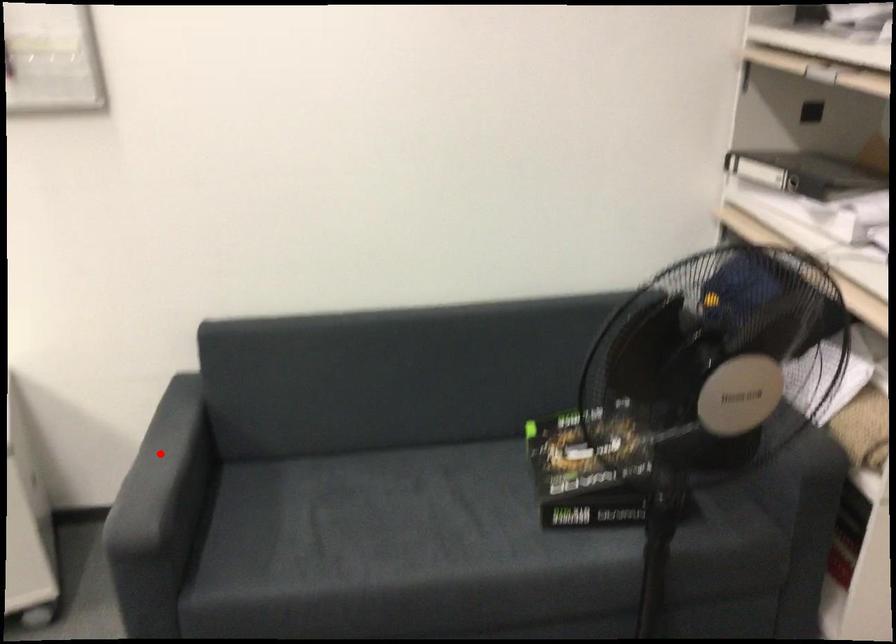
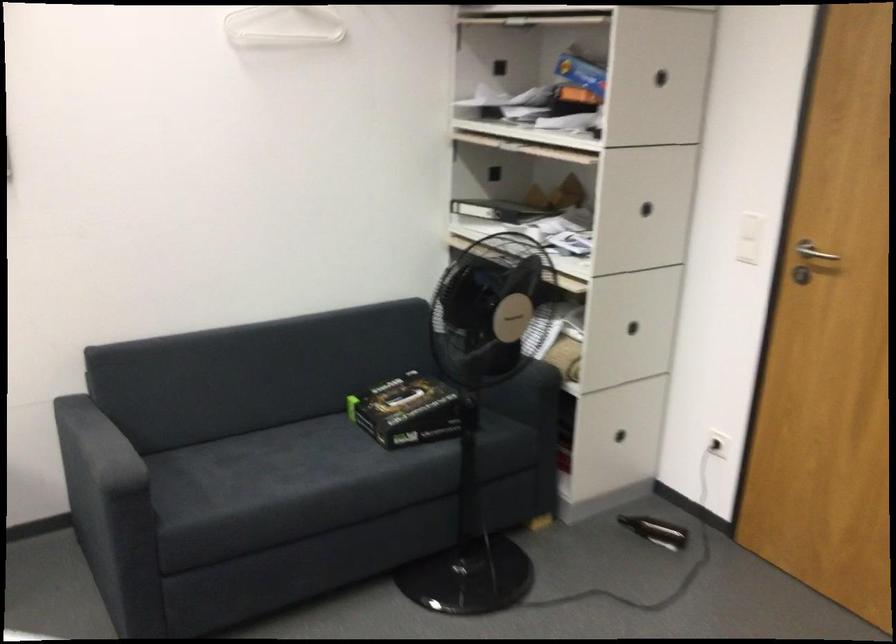
Question: I am providing you with two images of the same scene from different viewpoints. Given a red point in image1, look at the same physical point in image2. Is it:

Choices:
 (A) Closer to the viewpoint
 (B) Farther from the viewpoint

Answer: (B)